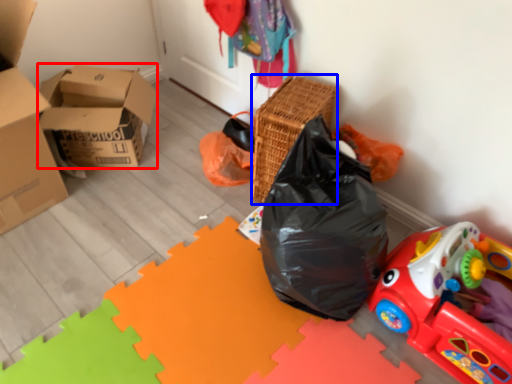
Question: Which point is closer to the camera, box (highlighted by a red box) or basket (highlighted by a blue box)?

Choices:
 (A) box
 (B) basket

Answer: (B)